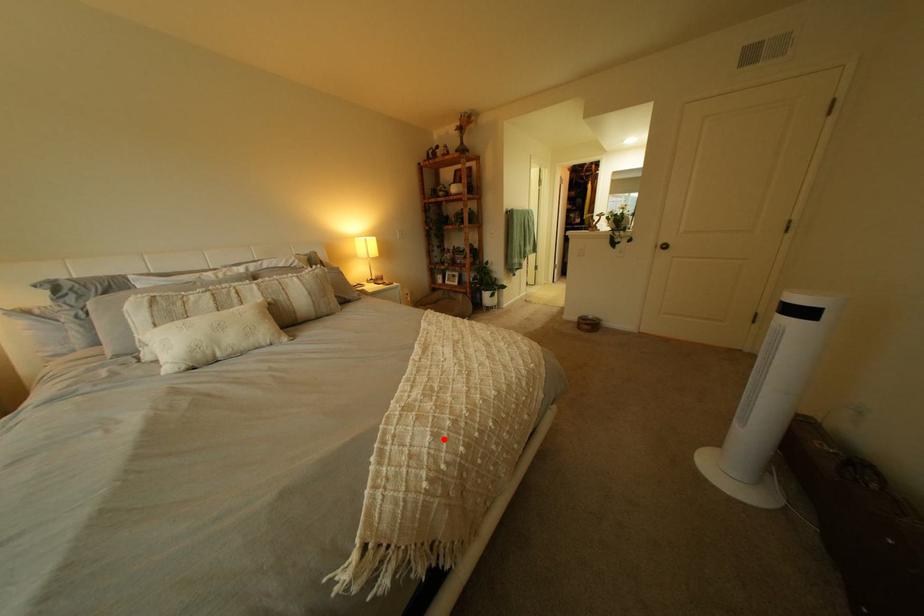
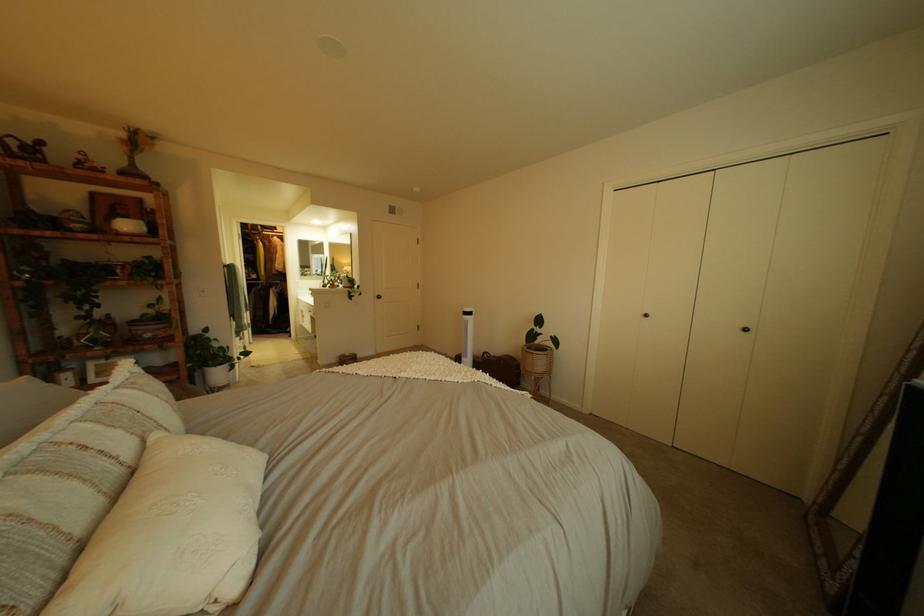
Question: I am providing you with two images of the same scene from different viewpoints. In image1, a red point is highlighted. Considering the same 3D point in image2, which of the following is correct?

Choices:
 (A) It is closer
 (B) It is farther

Answer: (A)